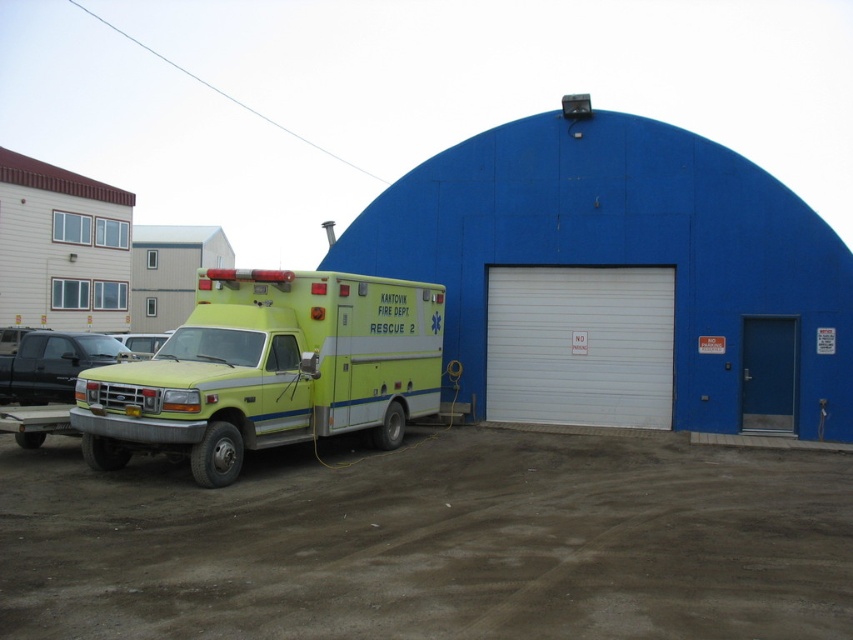
Question: Does white smooth garage door at center appear under blue matte door at right?

Choices:
 (A) no
 (B) yes

Answer: (A)

Question: Which point appears closest to the camera in this image?

Choices:
 (A) (746, 340)
 (B) (247, 348)

Answer: (B)

Question: Among these objects, which one is nearest to the camera?

Choices:
 (A) white smooth garage door at center
 (B) blue matte door at right
 (C) yellow matte ambulance at center

Answer: (C)

Question: Which point is farther to the camera?

Choices:
 (A) (x=340, y=369)
 (B) (x=762, y=378)
 (C) (x=643, y=294)

Answer: (C)

Question: Does yellow matte ambulance at center lie behind white smooth garage door at center?

Choices:
 (A) no
 (B) yes

Answer: (A)

Question: Is yellow matte ambulance at center further to camera compared to white smooth garage door at center?

Choices:
 (A) no
 (B) yes

Answer: (A)